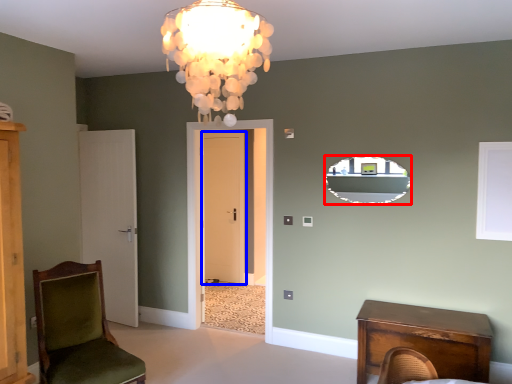
Question: Which point is further to the camera, mirror (highlighted by a red box) or door (highlighted by a blue box)?

Choices:
 (A) mirror
 (B) door

Answer: (B)